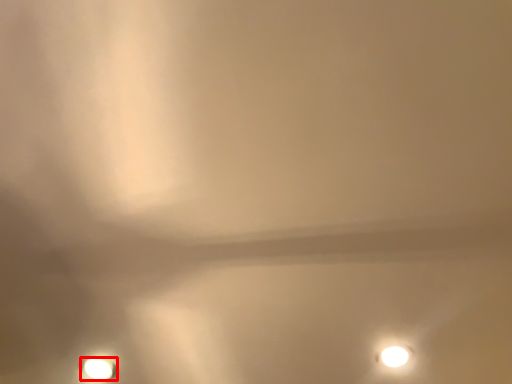
Question: Considering the relative positions of lamp (annotated by the red box) and lamp in the image provided, where is lamp (annotated by the red box) located with respect to the staircase?

Choices:
 (A) left
 (B) right

Answer: (A)